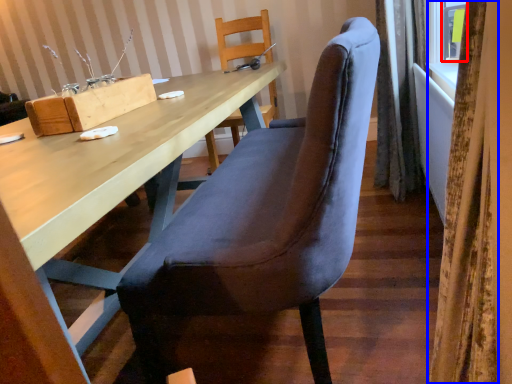
Question: Which point is further to the camera, window (highlighted by a red box) or curtain (highlighted by a blue box)?

Choices:
 (A) window
 (B) curtain

Answer: (A)